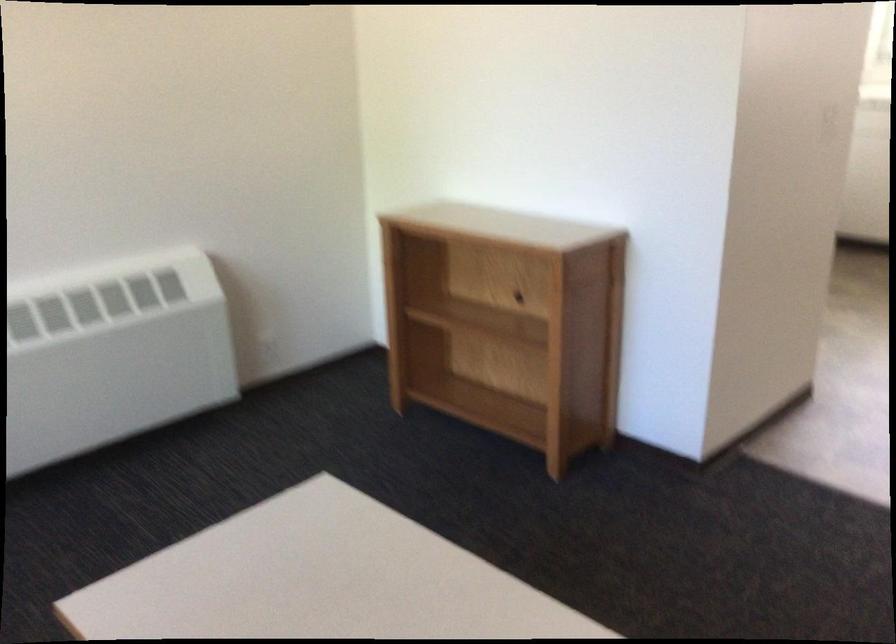
This screenshot has height=644, width=896. I want to click on small wooden bookcase, so click(x=506, y=323).